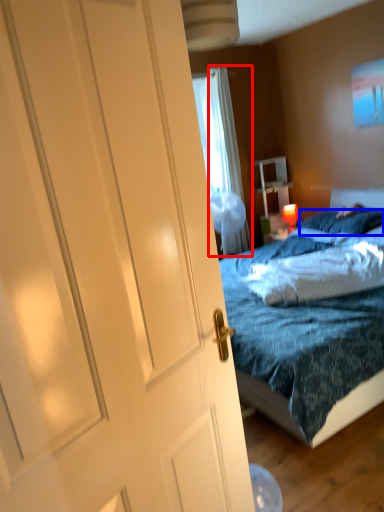
Question: Which of the following is the closest to the observer, curtain (highlighted by a red box) or pillow (highlighted by a blue box)?

Choices:
 (A) curtain
 (B) pillow

Answer: (B)